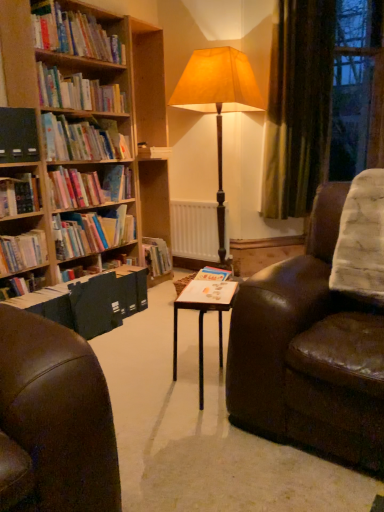
You are a GUI agent. You are given a task and a screenshot of the screen. Output one action in this format:
    pyautogui.click(x=<x>, y=<y>)
    Task: Click on the free space above matte paper at center, the first paperback book in the front-to-back sequence (from a real-world perspective)
    
    Given the screenshot: What is the action you would take?
    pyautogui.click(x=206, y=292)